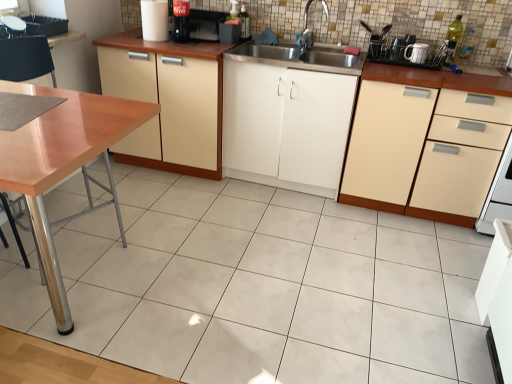
Question: Can we say white glossy mug at upper right lies outside black plastic dish rack at upper right, acting as the third appliance starting from the left?

Choices:
 (A) yes
 (B) no

Answer: (B)

Question: Is black plastic dish rack at upper right, the 2th appliance when ordered from right to left, located within white glossy mug at upper right?

Choices:
 (A) yes
 (B) no

Answer: (B)

Question: Does white glossy mug at upper right have a lesser height compared to black plastic dish rack at upper right, acting as the third appliance starting from the left?

Choices:
 (A) yes
 (B) no

Answer: (A)

Question: From a real-world perspective, is white glossy mug at upper right on top of black plastic dish rack at upper right, the 2th appliance when ordered from right to left?

Choices:
 (A) no
 (B) yes

Answer: (B)

Question: Can you confirm if white glossy mug at upper right is smaller than black plastic dish rack at upper right, acting as the third appliance starting from the left?

Choices:
 (A) no
 (B) yes

Answer: (B)

Question: From a real-world perspective, is white glossy mug at upper right below black plastic dish rack at upper right, the 2th appliance when ordered from right to left?

Choices:
 (A) no
 (B) yes

Answer: (A)

Question: Is beige matte cabinet at right, which is the 1th cabinetry from right to left, further to camera compared to wooden table at left?

Choices:
 (A) yes
 (B) no

Answer: (A)

Question: From the image's perspective, is beige matte cabinet at right, which is the 1th cabinetry from right to left, on wooden table at left?

Choices:
 (A) no
 (B) yes

Answer: (B)

Question: Could you tell me if beige matte cabinet at right, which is the 1th cabinetry from right to left, is turned towards wooden table at left?

Choices:
 (A) yes
 (B) no

Answer: (B)

Question: Does beige matte cabinet at right, the 3th cabinetry positioned from the left, have a lesser width compared to wooden table at left?

Choices:
 (A) no
 (B) yes

Answer: (B)

Question: From the image's perspective, is beige matte cabinet at right, which is the 1th cabinetry from right to left, located beneath wooden table at left?

Choices:
 (A) no
 (B) yes

Answer: (A)

Question: Is beige matte cabinet at right, which is the 1th cabinetry from right to left, smaller than wooden table at left?

Choices:
 (A) no
 (B) yes

Answer: (B)

Question: Is the position of wooden table at left more distant than that of beige matte cabinet at right, which is the 1th cabinetry from right to left?

Choices:
 (A) no
 (B) yes

Answer: (A)